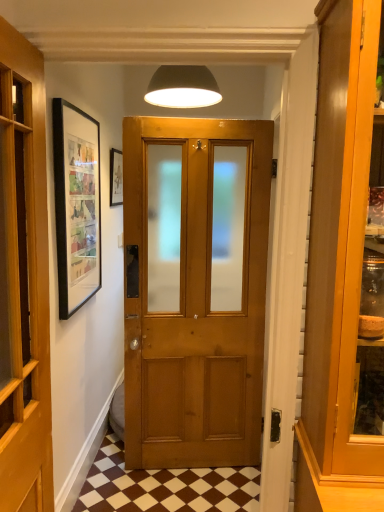
Question: Can you confirm if brown checkered tile at lower center is wider than wooden door at center?

Choices:
 (A) no
 (B) yes

Answer: (B)

Question: Is brown checkered tile at lower center at the right side of wooden door at center?

Choices:
 (A) yes
 (B) no

Answer: (A)

Question: Would you say brown checkered tile at lower center is a long distance from wooden door at center?

Choices:
 (A) yes
 (B) no

Answer: (A)

Question: Is brown checkered tile at lower center with wooden door at center?

Choices:
 (A) no
 (B) yes

Answer: (A)

Question: Can you confirm if brown checkered tile at lower center is shorter than wooden door at center?

Choices:
 (A) no
 (B) yes

Answer: (B)

Question: Is point (114, 181) closer or farther from the camera than point (14, 178)?

Choices:
 (A) closer
 (B) farther

Answer: (B)

Question: From the image's perspective, is matte black picture frame at upper left above or below wooden door at center?

Choices:
 (A) above
 (B) below

Answer: (A)

Question: Considering the positions of matte black picture frame at upper left and wooden door at center in the image, is matte black picture frame at upper left taller or shorter than wooden door at center?

Choices:
 (A) short
 (B) tall

Answer: (A)

Question: Looking at the image, does matte black picture frame at upper left seem bigger or smaller compared to wooden door at center?

Choices:
 (A) big
 (B) small

Answer: (B)

Question: From a real-world perspective, is matte black picture frame at upper left above or below matte black lampshade at upper center?

Choices:
 (A) above
 (B) below

Answer: (B)

Question: Considering the positions of point (112, 167) and point (196, 105), is point (112, 167) closer or farther from the camera than point (196, 105)?

Choices:
 (A) farther
 (B) closer

Answer: (A)

Question: Based on their positions, is matte black picture frame at upper left located to the left or right of matte black lampshade at upper center?

Choices:
 (A) right
 (B) left

Answer: (B)

Question: Is matte black picture frame at upper left inside the boundaries of matte black lampshade at upper center, or outside?

Choices:
 (A) inside
 (B) outside

Answer: (B)

Question: Is matte black lampshade at upper center wider or thinner than matte black picture frame at upper left?

Choices:
 (A) thin
 (B) wide

Answer: (B)

Question: Does point (178, 80) appear closer or farther from the camera than point (115, 202)?

Choices:
 (A) farther
 (B) closer

Answer: (B)